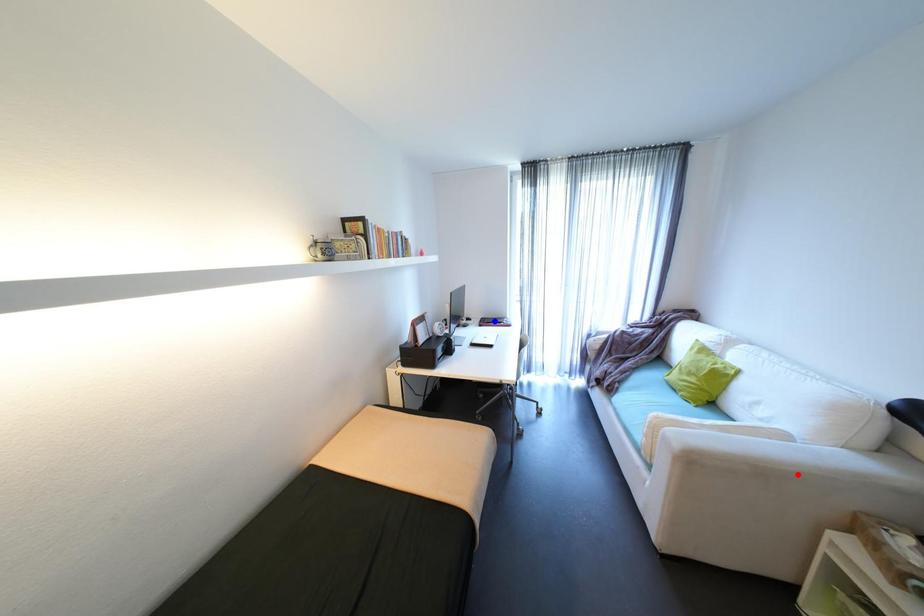
Question: Two points are marked on the image. Which point is closer to the camera?

Choices:
 (A) Blue point is closer.
 (B) Red point is closer.

Answer: (B)